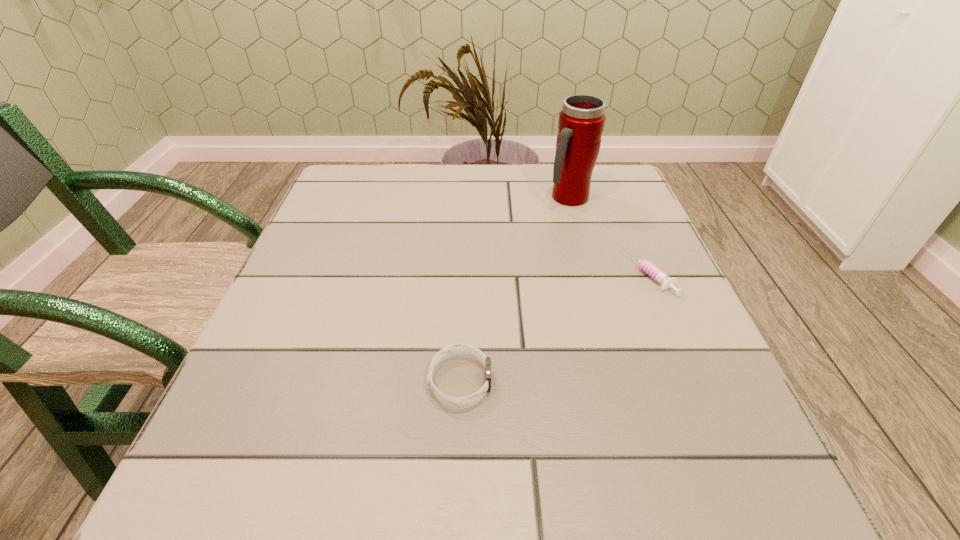
You are a GUI agent. You are given a task and a screenshot of the screen. Output one action in this format:
    pyautogui.click(x=<x>, y=<y>)
    Task: Click on the blank region between the shortest object and the thermos bottle
    
    Given the screenshot: What is the action you would take?
    pyautogui.click(x=609, y=236)

Identify the location of vacant space that is in between the second object from right to left and the shortest object. Image resolution: width=960 pixels, height=540 pixels. (609, 236).

The height and width of the screenshot is (540, 960). I want to click on free space between the nearest object and the tallest object, so click(x=515, y=289).

I want to click on free space between the second object from left to right and the second tallest object, so point(515,289).

The image size is (960, 540). Identify the location of vacant point located between the farthest object and the syringe. (609, 236).

Identify the location of vacant space that's between the tallest object and the shortest object. (609, 236).

At what (x,y) coordinates should I click in order to perform the action: click on free spot between the farthest object and the rightmost object. Please return your answer as a coordinate pair (x, y). Looking at the image, I should click on (609, 236).

The width and height of the screenshot is (960, 540). In order to click on free space between the wristband and the second farthest object in this screenshot , I will do `click(554, 327)`.

What are the coordinates of `vacant space in between the syringe and the farthest object` in the screenshot? It's located at (609, 236).

Select which object appears as the second closest to the tallest object. Please provide its 2D coordinates. Your answer should be formatted as a tuple, i.e. [(x, y)], where the tuple contains the x and y coordinates of a point satisfying the conditions above.

[(453, 349)]